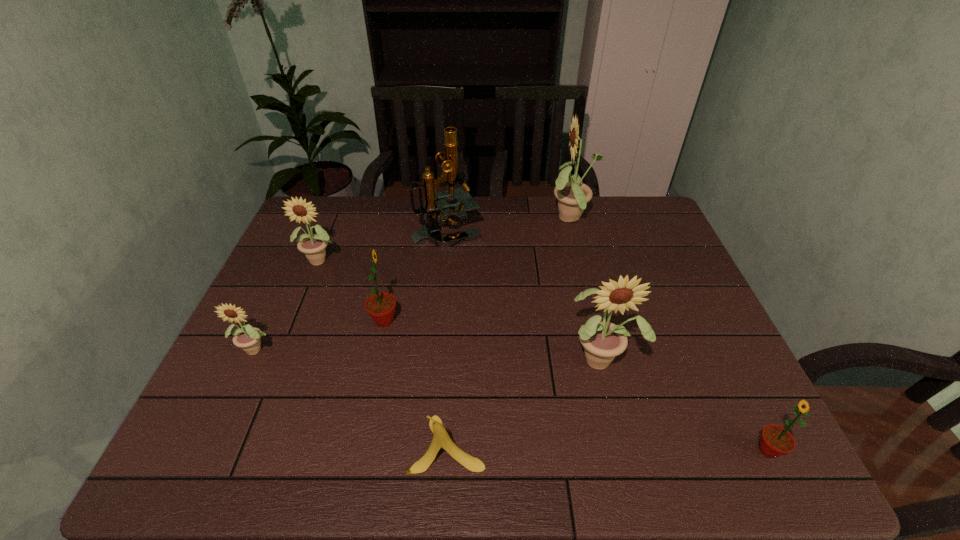
Image resolution: width=960 pixels, height=540 pixels. What are the coordinates of `sunflower that is the second closest one to the banana` in the screenshot? It's located at coord(381,306).

Where is `sunflower that can be found as the closest to the smallest yellow sunflower`? The height and width of the screenshot is (540, 960). sunflower that can be found as the closest to the smallest yellow sunflower is located at coordinates (381, 306).

Where is `yellow sunflower that stands as the second closest to the fifth shortest sunflower`? Image resolution: width=960 pixels, height=540 pixels. yellow sunflower that stands as the second closest to the fifth shortest sunflower is located at coordinates (312, 245).

The width and height of the screenshot is (960, 540). I want to click on yellow sunflower that is the closest to the fourth farthest object, so click(x=312, y=245).

Identify the location of vacant space that satisfies the following two spatial constraints: 1. at the eyepiece of the shortest object; 2. on the left side of the microscope. This screenshot has width=960, height=540. (427, 444).

What are the coordinates of `free spot that satisfies the following two spatial constraints: 1. on the front-facing side of the smallest yellow sunflower; 2. on the right side of the banana` in the screenshot? It's located at 213,444.

Locate an element on the screen. vacant area in the image that satisfies the following two spatial constraints: 1. at the eyepiece of the gold microscope; 2. on the front-facing side of the smallest yellow sunflower is located at coordinates (436, 348).

The image size is (960, 540). I want to click on vacant position in the image that satisfies the following two spatial constraints: 1. on the front-facing side of the tallest sunflower; 2. on the front-facing side of the second tallest sunflower, so click(608, 358).